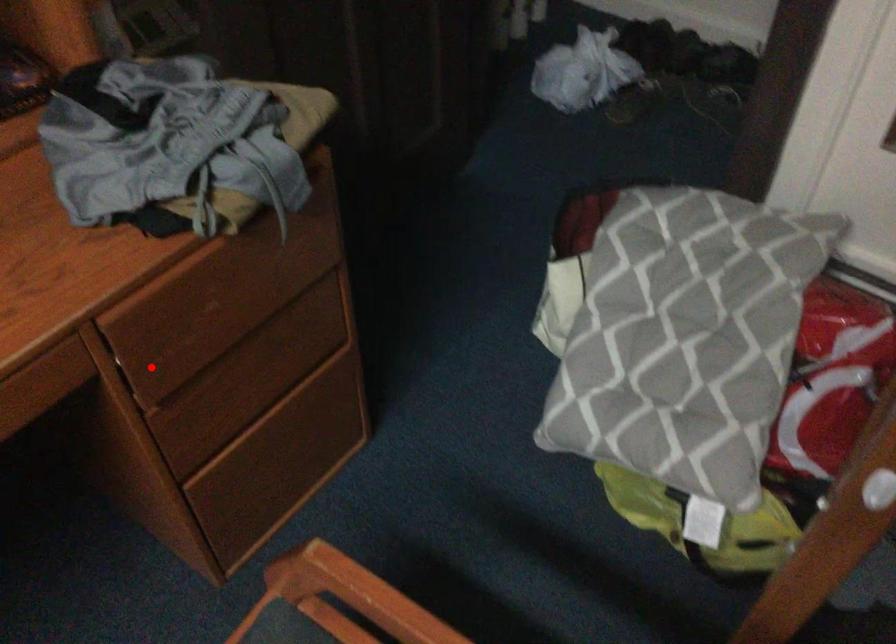
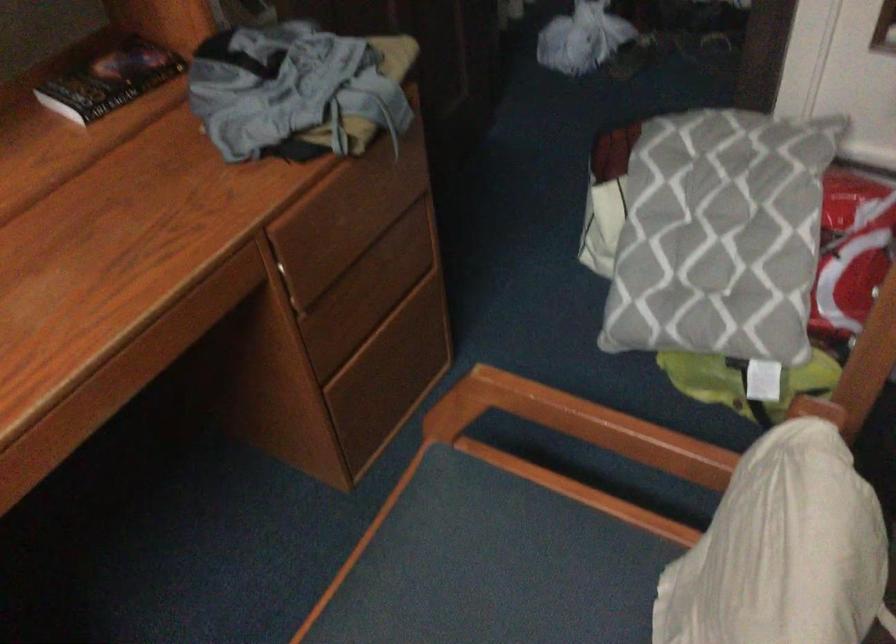
Where in the second image is the point corresponding to the highlighted location from the first image?

(299, 276)